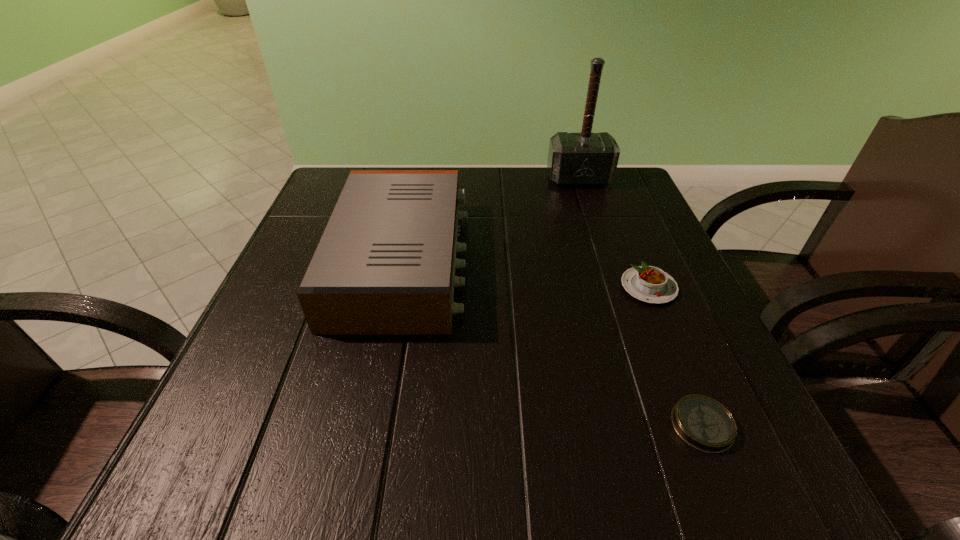
Where is `free space between the compass and the farthest object`? The height and width of the screenshot is (540, 960). free space between the compass and the farthest object is located at coordinates (640, 302).

I want to click on free space between the leftmost object and the pudding, so click(525, 274).

Image resolution: width=960 pixels, height=540 pixels. I want to click on blank region between the farthest object and the pudding, so click(613, 233).

I want to click on empty space between the leftmost object and the shortest object, so click(x=552, y=343).

Find the location of a particular element. vacant area that lies between the pudding and the leftmost object is located at coordinates point(525,274).

Find the location of a particular element. This screenshot has width=960, height=540. object that is the closest to the hammer is located at coordinates (385, 264).

You are a GUI agent. You are given a task and a screenshot of the screen. Output one action in this format:
    pyautogui.click(x=<x>, y=<y>)
    Task: Click on the object that is the third closest to the hammer
    
    Given the screenshot: What is the action you would take?
    pyautogui.click(x=703, y=423)

Image resolution: width=960 pixels, height=540 pixels. What are the coordinates of `vacant region that satisfies the following two spatial constraints: 1. on the control panel of the radio receiver; 2. on the back side of the shortest object` in the screenshot? It's located at (370, 425).

Locate an element on the screen. The image size is (960, 540). vacant space that satisfies the following two spatial constraints: 1. on the control panel of the third shortest object; 2. on the right side of the compass is located at coordinates (370, 425).

You are a GUI agent. You are given a task and a screenshot of the screen. Output one action in this format:
    pyautogui.click(x=<x>, y=<y>)
    Task: Click on the vacant space that satisfies the following two spatial constraints: 1. on the control panel of the radio receiver; 2. on the right side of the compass
    This screenshot has width=960, height=540.
    Given the screenshot: What is the action you would take?
    [370, 425]